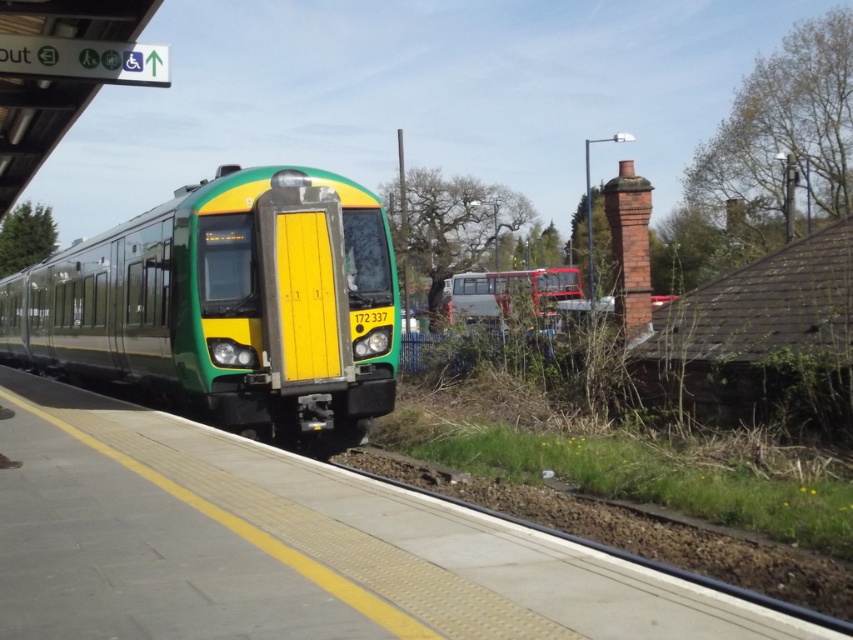
Who is lower down, green matte train at center or brown gravel train track at lower center?

brown gravel train track at lower center

Does green matte train at center have a greater width compared to brown gravel train track at lower center?

Yes, green matte train at center is wider than brown gravel train track at lower center.

This screenshot has width=853, height=640. I want to click on green matte train at center, so point(229,305).

In order to click on green matte train at center in this screenshot , I will do `click(229, 305)`.

Which is below, concrete platform at center or metallic silver bus at center?

concrete platform at center is below.

Which of these two, concrete platform at center or metallic silver bus at center, stands taller?

Standing taller between the two is metallic silver bus at center.

Locate an element on the screen. concrete platform at center is located at coordinates (294, 545).

This screenshot has width=853, height=640. Identify the location of concrete platform at center. (294, 545).

Is brown gravel train track at lower center shorter than metallic silver bus at center?

Correct, brown gravel train track at lower center is not as tall as metallic silver bus at center.

Can you confirm if brown gravel train track at lower center is wider than metallic silver bus at center?

Incorrect, brown gravel train track at lower center's width does not surpass metallic silver bus at center's.

Which is behind, point (665, 564) or point (511, 292)?

Point (511, 292)

What are the coordinates of `brown gravel train track at lower center` in the screenshot? It's located at (643, 541).